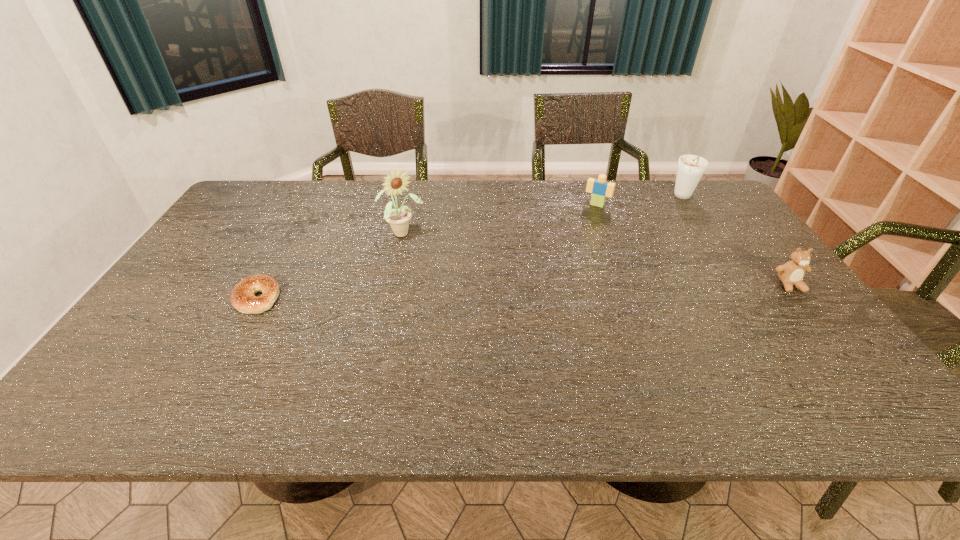
Locate an element on the screen. The height and width of the screenshot is (540, 960). root beer present at the far edge is located at coordinates (691, 168).

This screenshot has height=540, width=960. Find the location of `teddy bear situated at the right edge`. teddy bear situated at the right edge is located at coordinates (791, 274).

Identify the location of root beer present at the right edge. Image resolution: width=960 pixels, height=540 pixels. (691, 168).

Where is `object present at the far right corner`? object present at the far right corner is located at coordinates (691, 168).

This screenshot has width=960, height=540. In the image, there is a desktop. In order to click on free space at the far edge in this screenshot , I will do `click(616, 212)`.

Where is `vacant space at the near edge`? vacant space at the near edge is located at coordinates (190, 369).

The height and width of the screenshot is (540, 960). What are the coordinates of `free region at the left edge` in the screenshot? It's located at (196, 288).

Where is `blank space at the right edge`? blank space at the right edge is located at coordinates (793, 300).

Find the location of a particular element. free space at the far left corner of the desktop is located at coordinates (254, 202).

In the image, there is a desktop. Where is `free region at the near left corner`? free region at the near left corner is located at coordinates (163, 347).